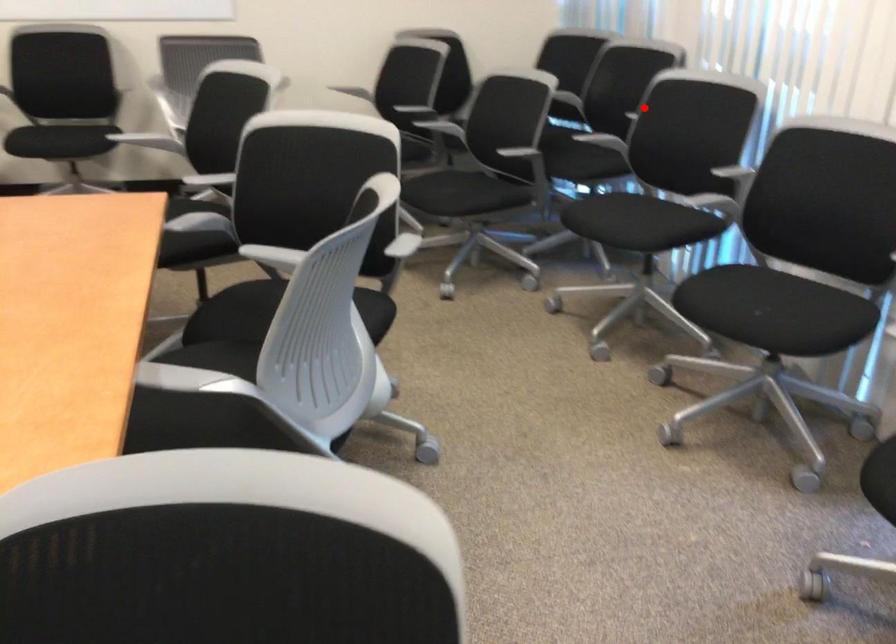
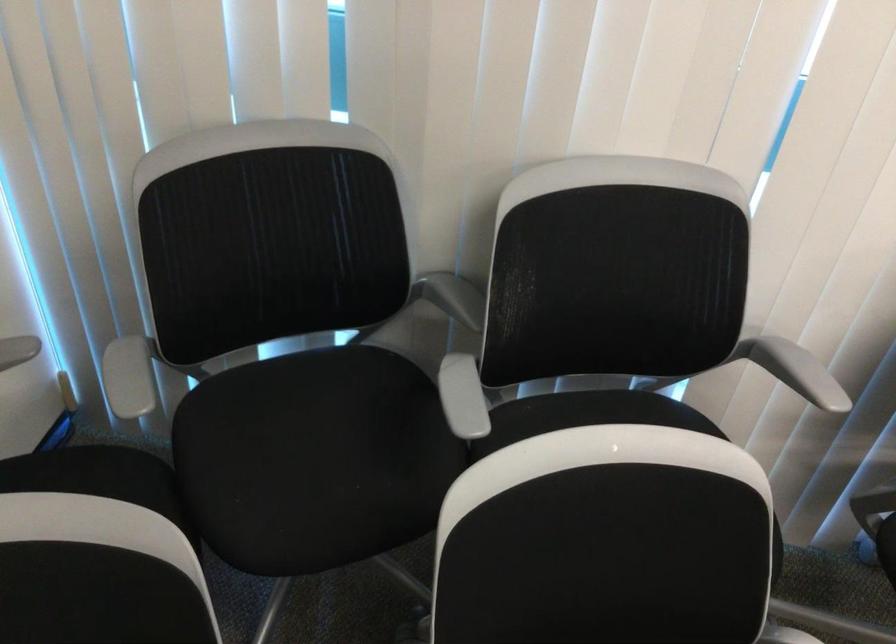
In the second image, find the point that corresponds to the highlighted location in the first image.

(794, 370)